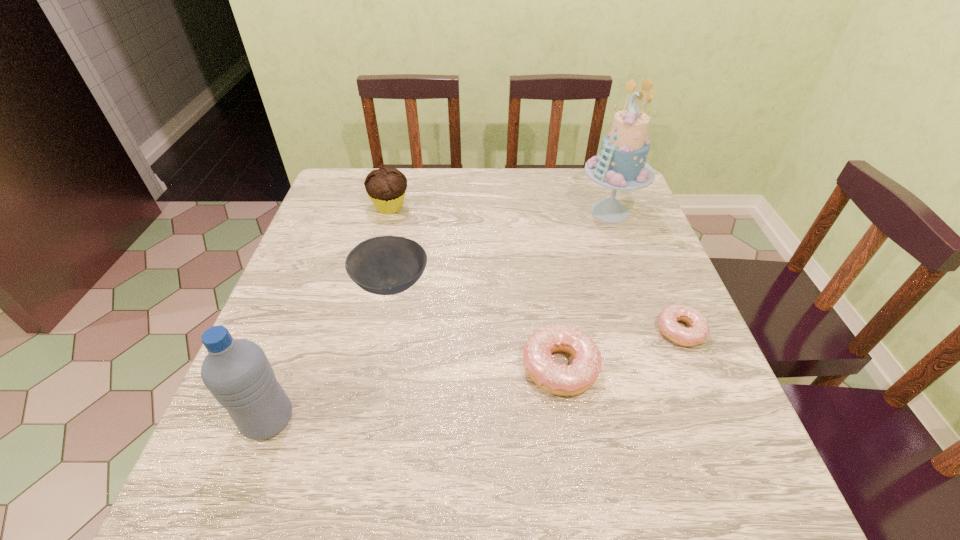
Locate an element on the screen. The width and height of the screenshot is (960, 540). vacant area that lies between the cake and the shorter doughnut is located at coordinates (645, 271).

The width and height of the screenshot is (960, 540). Find the location of `vacant area between the third object from right to left and the fourth shortest object`. vacant area between the third object from right to left and the fourth shortest object is located at coordinates (474, 287).

Locate which object ranks fifth in proximity to the third shortest object. Please provide its 2D coordinates. Your answer should be formatted as a tuple, i.e. [(x, y)], where the tuple contains the x and y coordinates of a point satisfying the conditions above.

[(668, 324)]

At what (x,y) coordinates should I click in order to perform the action: click on object that ranks as the fifth closest to the second shortest object. Please return your answer as a coordinate pair (x, y). The height and width of the screenshot is (540, 960). Looking at the image, I should click on (386, 186).

This screenshot has width=960, height=540. Identify the location of blank space that satisfies the following two spatial constraints: 1. on the back side of the fifth shortest object; 2. on the left side of the bowl. (319, 285).

I want to click on free space that satisfies the following two spatial constraints: 1. with a ladder on the side of the shortest object; 2. on the right side of the cake, so click(x=653, y=331).

Locate an element on the screen. The image size is (960, 540). free space that satisfies the following two spatial constraints: 1. with a ladder on the side of the cake; 2. on the front side of the fourth tallest object is located at coordinates (636, 285).